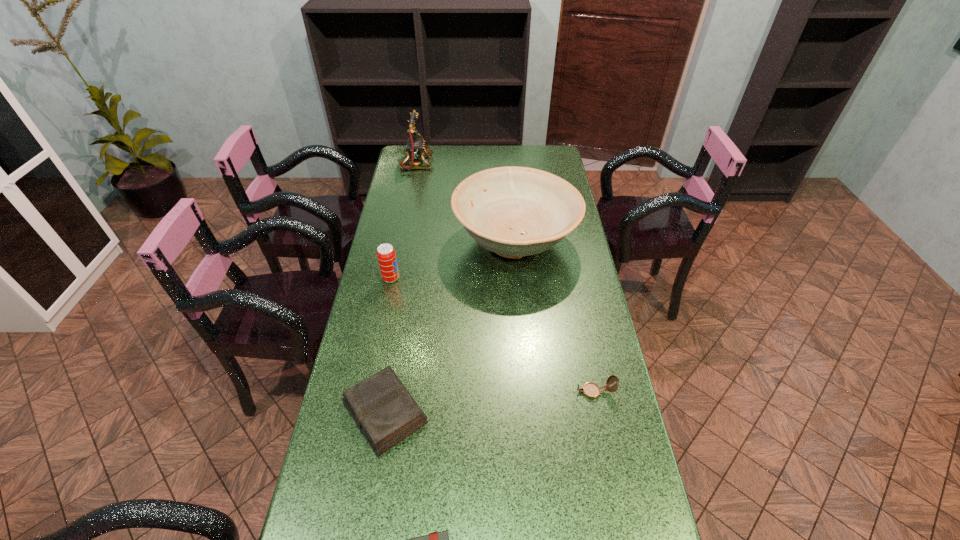
Where is `free space at the far edge of the desktop`? free space at the far edge of the desktop is located at coordinates (517, 146).

This screenshot has height=540, width=960. Find the location of `free space at the left edge`. free space at the left edge is located at coordinates (379, 237).

I want to click on vacant space at the right edge of the desktop, so click(607, 343).

This screenshot has height=540, width=960. Identify the location of free space at the far right corner. (541, 169).

Identify the location of free space between the dish and the soda can. This screenshot has height=540, width=960. (453, 260).

Locate an element on the screen. blank region between the soda can and the dish is located at coordinates (453, 260).

Where is `vacant area that lies between the compass and the second shortest object`? vacant area that lies between the compass and the second shortest object is located at coordinates (490, 402).

The width and height of the screenshot is (960, 540). I want to click on empty space between the taller book and the dish, so click(450, 327).

I want to click on free space that is in between the fourth shortest object and the compass, so click(492, 335).

Locate an element on the screen. Image resolution: width=960 pixels, height=540 pixels. vacant area that lies between the second shortest object and the dish is located at coordinates (450, 327).